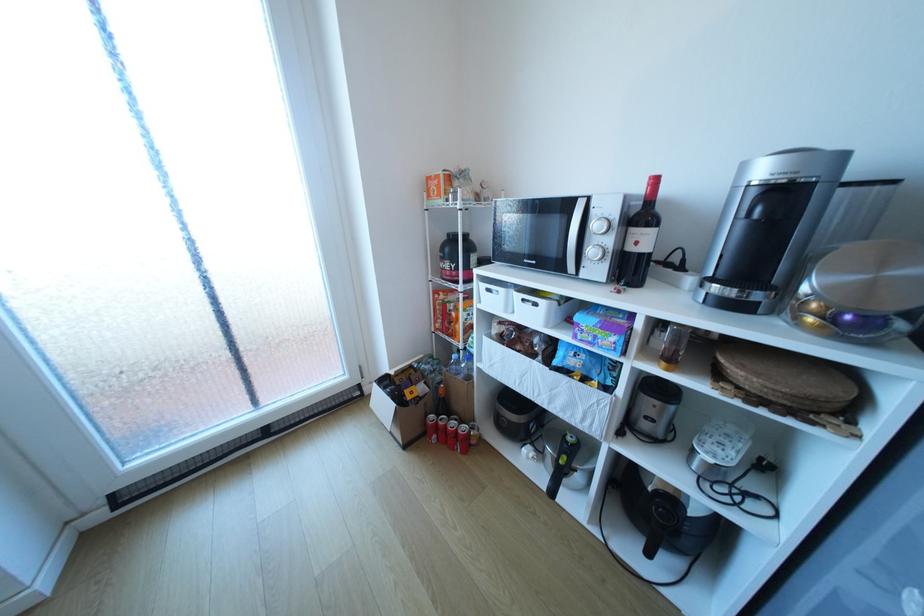
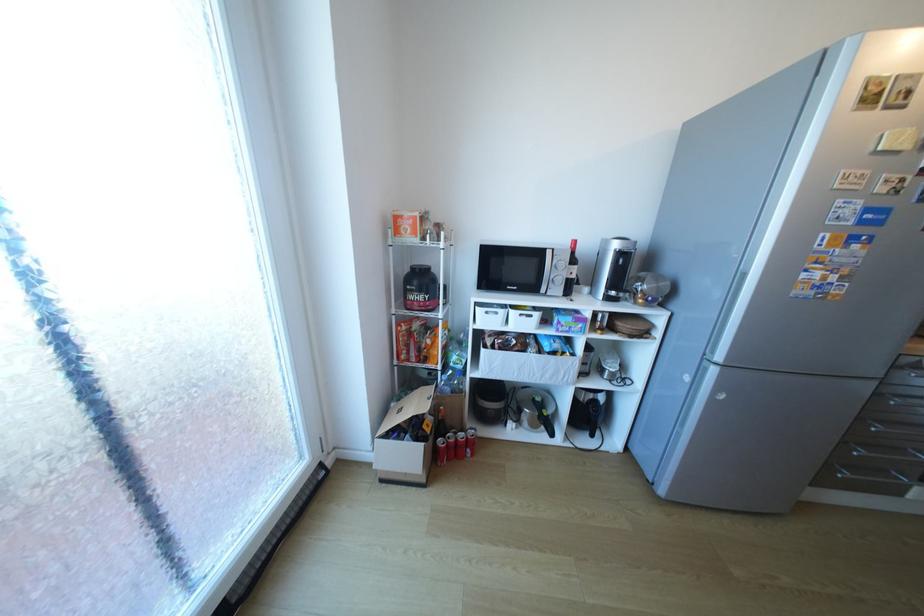
Where in the second image is the point corresponding to pixel 476 382 from the first image?

(472, 394)